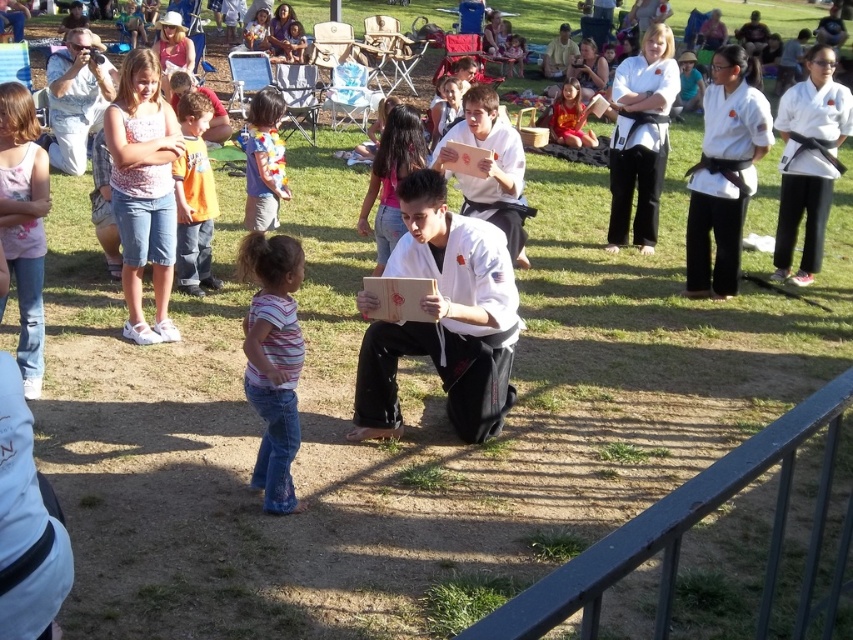
Question: Which of the following is the closest to the observer?

Choices:
 (A) (366, 212)
 (B) (827, 624)
 (C) (363, 428)
 (D) (293, 422)

Answer: (B)

Question: Observing the image, what is the correct spatial positioning of orange cotton shirt at upper left in reference to striped shirt at center?

Choices:
 (A) left
 (B) right

Answer: (A)

Question: Which object is closer to the camera taking this photo?

Choices:
 (A) white matte board at center
 (B) striped cotton shirt at center
 (C) orange cotton shirt at upper left
 (D) white matte karate uniform at upper right

Answer: (B)

Question: Which of the following is the closest to the observer?

Choices:
 (A) (401, 218)
 (B) (682, 515)
 (C) (614, 250)
 (D) (289, 307)

Answer: (B)

Question: Is the position of metallic gray rail at lower right more distant than that of white matte karate uniform at upper right?

Choices:
 (A) yes
 (B) no

Answer: (B)

Question: Can you confirm if orange cotton shirt at upper left is positioned above matte orange shirt at upper center?

Choices:
 (A) yes
 (B) no

Answer: (B)